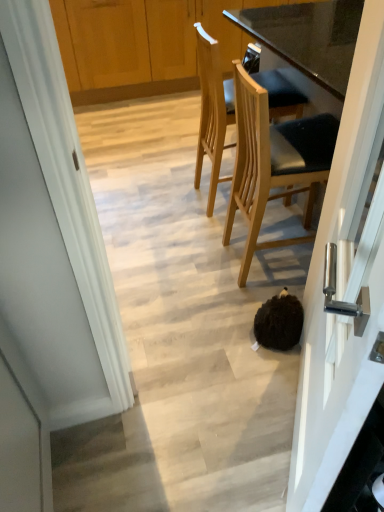
Question: From the image's perspective, is brown fuzzy ball at lower center beneath light wood/texture chair at upper center, which is the 2th chair from front to back?

Choices:
 (A) yes
 (B) no

Answer: (A)

Question: Is brown fuzzy ball at lower center positioned with its back to light wood/texture chair at upper center, arranged as the first chair when viewed from the back?

Choices:
 (A) no
 (B) yes

Answer: (A)

Question: Is brown fuzzy ball at lower center facing towards light wood/texture chair at upper center, which is the 2th chair from front to back?

Choices:
 (A) no
 (B) yes

Answer: (B)

Question: Does brown fuzzy ball at lower center lie behind light wood/texture chair at upper center, which is the 2th chair from front to back?

Choices:
 (A) no
 (B) yes

Answer: (A)

Question: Is brown fuzzy ball at lower center shorter than light wood/texture chair at upper center, which is the 2th chair from front to back?

Choices:
 (A) yes
 (B) no

Answer: (A)

Question: Considering the relative positions of brown fuzzy ball at lower center and light wood/texture chair at upper center, arranged as the first chair when viewed from the back, in the image provided, is brown fuzzy ball at lower center to the left of light wood/texture chair at upper center, arranged as the first chair when viewed from the back, from the viewer's perspective?

Choices:
 (A) no
 (B) yes

Answer: (A)

Question: Is light brown wood chair at center, which ranks as the 2th chair in back-to-front order, facing away from light wood/texture chair at upper center, which is the 2th chair from front to back?

Choices:
 (A) yes
 (B) no

Answer: (B)

Question: Considering the relative sizes of light brown wood chair at center, which ranks as the 2th chair in back-to-front order, and light wood/texture chair at upper center, arranged as the first chair when viewed from the back, in the image provided, is light brown wood chair at center, which ranks as the 2th chair in back-to-front order, thinner than light wood/texture chair at upper center, arranged as the first chair when viewed from the back,?

Choices:
 (A) no
 (B) yes

Answer: (A)

Question: Is light brown wood chair at center, which ranks as the 2th chair in back-to-front order, positioned beyond the bounds of light wood/texture chair at upper center, arranged as the first chair when viewed from the back?

Choices:
 (A) yes
 (B) no

Answer: (A)

Question: Is the position of light brown wood chair at center, marked as the first chair in a front-to-back arrangement, more distant than that of light wood/texture chair at upper center, arranged as the first chair when viewed from the back?

Choices:
 (A) no
 (B) yes

Answer: (A)

Question: From a real-world perspective, is light brown wood chair at center, marked as the first chair in a front-to-back arrangement, over light wood/texture chair at upper center, arranged as the first chair when viewed from the back?

Choices:
 (A) no
 (B) yes

Answer: (B)

Question: Is light brown wood chair at center, marked as the first chair in a front-to-back arrangement, in contact with light wood/texture chair at upper center, arranged as the first chair when viewed from the back?

Choices:
 (A) yes
 (B) no

Answer: (B)

Question: Is white glossy door handle at center right taller than light wood/texture chair at upper center, arranged as the first chair when viewed from the back?

Choices:
 (A) no
 (B) yes

Answer: (B)